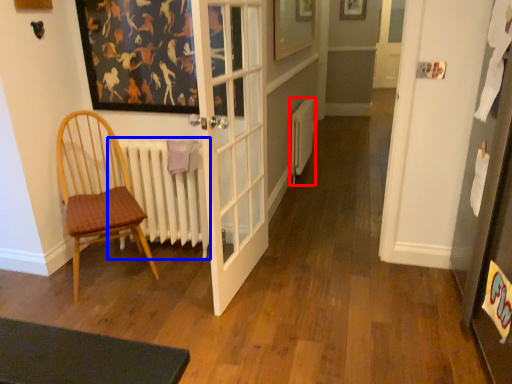
Question: Among these objects, which one is farthest to the camera, heater (highlighted by a red box) or radiator (highlighted by a blue box)?

Choices:
 (A) heater
 (B) radiator

Answer: (A)